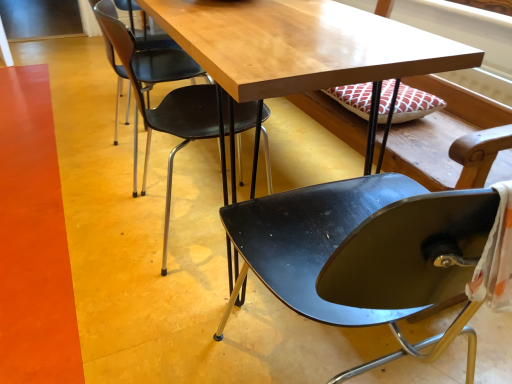
The image size is (512, 384). In order to click on vacant space that is to the left of glossy black chair at center, arranged as the 1th chair when viewed from the right in this screenshot , I will do `click(148, 327)`.